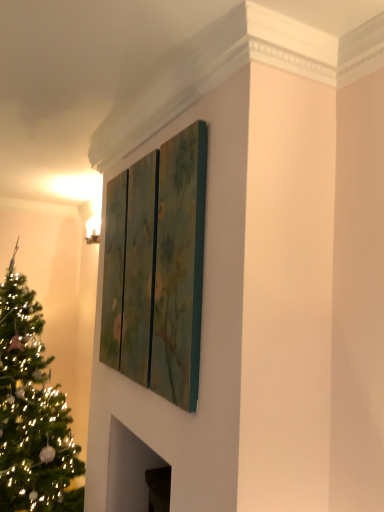
You are a GUI agent. You are given a task and a screenshot of the screen. Output one action in this format:
    pyautogui.click(x=<x>, y=<y>)
    Task: Click on the textured green triptych at upper center
    
    Given the screenshot: What is the action you would take?
    pyautogui.click(x=157, y=268)

The width and height of the screenshot is (384, 512). Describe the element at coordinates (157, 268) in the screenshot. I see `textured green triptych at upper center` at that location.

The height and width of the screenshot is (512, 384). Find the location of `shiny green christmas tree at left`. shiny green christmas tree at left is located at coordinates (32, 411).

Describe the element at coordinates (32, 411) in the screenshot. I see `shiny green christmas tree at left` at that location.

You are a GUI agent. You are given a task and a screenshot of the screen. Output one action in this format:
    pyautogui.click(x=<x>, y=<y>)
    Task: Click on the textured green triptych at upper center
    This screenshot has width=384, height=512.
    Given the screenshot: What is the action you would take?
    pyautogui.click(x=157, y=268)

Does textured green triptych at upper center appear on the right side of shiny green christmas tree at left?

Yes, textured green triptych at upper center is to the right of shiny green christmas tree at left.

Is the depth of textured green triptych at upper center less than that of shiny green christmas tree at left?

Yes, it is in front of shiny green christmas tree at left.

Which is nearer, (177,211) or (36,340)?

Clearly, point (177,211) is closer to the camera than point (36,340).

From the image's perspective, is textured green triptych at upper center on top of shiny green christmas tree at left?

Correct, textured green triptych at upper center appears higher than shiny green christmas tree at left in the image.

From a real-world perspective, who is located higher, textured green triptych at upper center or shiny green christmas tree at left?

From a 3D spatial view, textured green triptych at upper center is above.

Between textured green triptych at upper center and shiny green christmas tree at left, which one has smaller width?

textured green triptych at upper center.

From their relative heights in the image, would you say textured green triptych at upper center is taller or shorter than shiny green christmas tree at left?

Considering their sizes, textured green triptych at upper center has less height than shiny green christmas tree at left.

From the picture: Can you confirm if textured green triptych at upper center is bigger than shiny green christmas tree at left?

No.

Is textured green triptych at upper center spatially inside shiny green christmas tree at left, or outside of it?

textured green triptych at upper center cannot be found inside shiny green christmas tree at left.

Is textured green triptych at upper center beside shiny green christmas tree at left?

They are not placed beside each other.

Is textured green triptych at upper center aimed at shiny green christmas tree at left?

No, textured green triptych at upper center is not oriented towards shiny green christmas tree at left.

Can you tell me how much textured green triptych at upper center and shiny green christmas tree at left differ in facing direction?

The facing directions of textured green triptych at upper center and shiny green christmas tree at left are 1.29 degrees apart.

Where is `window in front of the shiny green christmas tree at left`? The image size is (384, 512). window in front of the shiny green christmas tree at left is located at coordinates (157, 268).

Is shiny green christmas tree at left at the left side of textured green triptych at upper center?

Yes, shiny green christmas tree at left is to the left of textured green triptych at upper center.

Is shiny green christmas tree at left further to camera compared to textured green triptych at upper center?

Yes.

Considering the positions of points (12, 264) and (185, 286), is point (12, 264) farther from camera compared to point (185, 286)?

Yes, point (12, 264) is farther from viewer.

From the image's perspective, which is above, shiny green christmas tree at left or textured green triptych at upper center?

textured green triptych at upper center appears higher in the image.

From the picture: From a real-world perspective, is shiny green christmas tree at left located higher than textured green triptych at upper center?

Actually, shiny green christmas tree at left is physically below textured green triptych at upper center in the real world.

Does shiny green christmas tree at left have a greater width compared to textured green triptych at upper center?

Correct, the width of shiny green christmas tree at left exceeds that of textured green triptych at upper center.

Can you confirm if shiny green christmas tree at left is shorter than textured green triptych at upper center?

No.

In the scene shown: Looking at the image, does shiny green christmas tree at left seem bigger or smaller compared to textured green triptych at upper center?

In the image, shiny green christmas tree at left appears to be larger than textured green triptych at upper center.

Can we say shiny green christmas tree at left lies outside textured green triptych at upper center?

That's correct, shiny green christmas tree at left is outside of textured green triptych at upper center.

Is shiny green christmas tree at left not near textured green triptych at upper center?

shiny green christmas tree at left is far away from textured green triptych at upper center.

Consider the image. Is shiny green christmas tree at left facing away from textured green triptych at upper center?

No, textured green triptych at upper center is not at the back of shiny green christmas tree at left.

Can you tell me how much shiny green christmas tree at left and textured green triptych at upper center differ in facing direction?

They differ by 1.29 degrees in their facing directions.

Identify the location of christmas tree lying behind the textured green triptych at upper center. The height and width of the screenshot is (512, 384). (32, 411).

The image size is (384, 512). In order to click on window located above the shiny green christmas tree at left (from the image's perspective) in this screenshot , I will do `click(157, 268)`.

Identify the location of christmas tree that appears below the textured green triptych at upper center (from a real-world perspective). (32, 411).